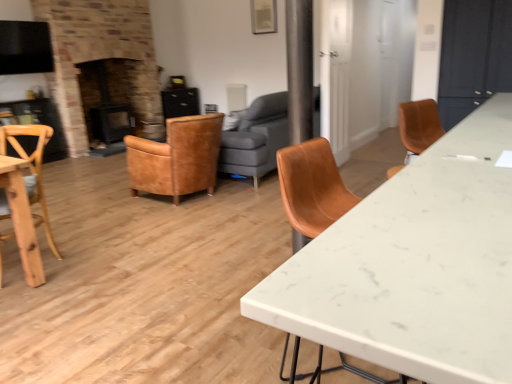
Question: Can you confirm if leather couch at center is wider than black glossy exhaust hood at upper left?

Choices:
 (A) yes
 (B) no

Answer: (A)

Question: Considering the relative sizes of leather couch at center and black glossy exhaust hood at upper left in the image provided, is leather couch at center smaller than black glossy exhaust hood at upper left?

Choices:
 (A) no
 (B) yes

Answer: (A)

Question: Is black glossy exhaust hood at upper left located within leather couch at center?

Choices:
 (A) yes
 (B) no

Answer: (B)

Question: Can you confirm if leather couch at center is shorter than black glossy exhaust hood at upper left?

Choices:
 (A) yes
 (B) no

Answer: (B)

Question: From the image's perspective, is leather couch at center over black glossy exhaust hood at upper left?

Choices:
 (A) yes
 (B) no

Answer: (B)

Question: Is white marble desk at center taller or shorter than leather armchair at center, which ranks as the 1th chair in right-to-left order?

Choices:
 (A) short
 (B) tall

Answer: (B)

Question: Visually, is white marble desk at center positioned to the left or to the right of leather armchair at center, the 2th chair in the left-to-right sequence?

Choices:
 (A) right
 (B) left

Answer: (A)

Question: From a real-world perspective, is white marble desk at center positioned above or below leather armchair at center, the 2th chair in the left-to-right sequence?

Choices:
 (A) above
 (B) below

Answer: (A)

Question: Is white marble desk at center wider or thinner than leather armchair at center, marked as the 1th chair in a back-to-front arrangement?

Choices:
 (A) wide
 (B) thin

Answer: (B)

Question: From the image's perspective, is black matte fireplace at left above or below white marble desk at center?

Choices:
 (A) above
 (B) below

Answer: (A)

Question: In terms of size, does black matte fireplace at left appear bigger or smaller than white marble desk at center?

Choices:
 (A) small
 (B) big

Answer: (B)

Question: Considering the positions of point (84, 94) and point (458, 144), is point (84, 94) closer or farther from the camera than point (458, 144)?

Choices:
 (A) closer
 (B) farther

Answer: (B)

Question: Is black matte fireplace at left spatially inside white marble desk at center, or outside of it?

Choices:
 (A) outside
 (B) inside

Answer: (A)

Question: From their relative heights in the image, would you say leather armchair at center, marked as the 1th chair in a back-to-front arrangement, is taller or shorter than natural wood chair at left, the 2th chair viewed from the right?

Choices:
 (A) tall
 (B) short

Answer: (B)

Question: Is point (199, 177) positioned closer to the camera than point (45, 201)?

Choices:
 (A) closer
 (B) farther

Answer: (B)